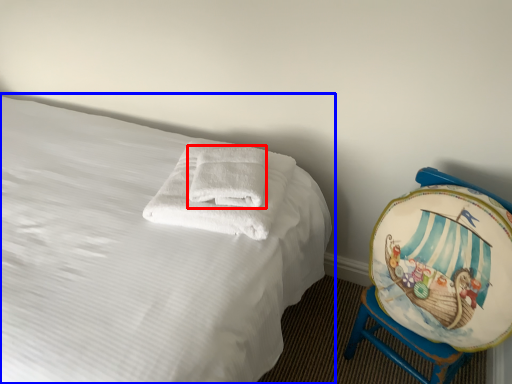
Question: Which of the following is the farthest to the observer, bath towel (highlighted by a red box) or bed (highlighted by a blue box)?

Choices:
 (A) bath towel
 (B) bed

Answer: (A)